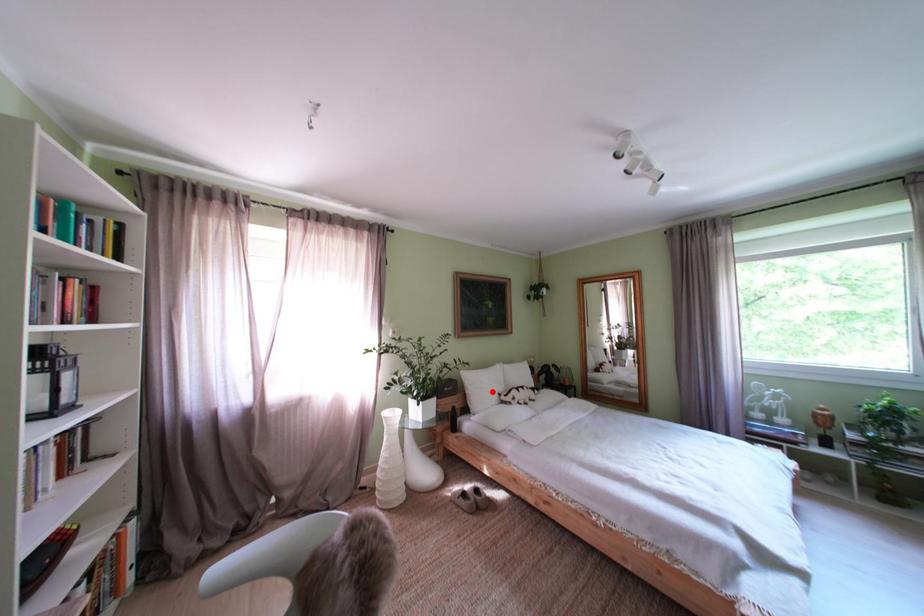
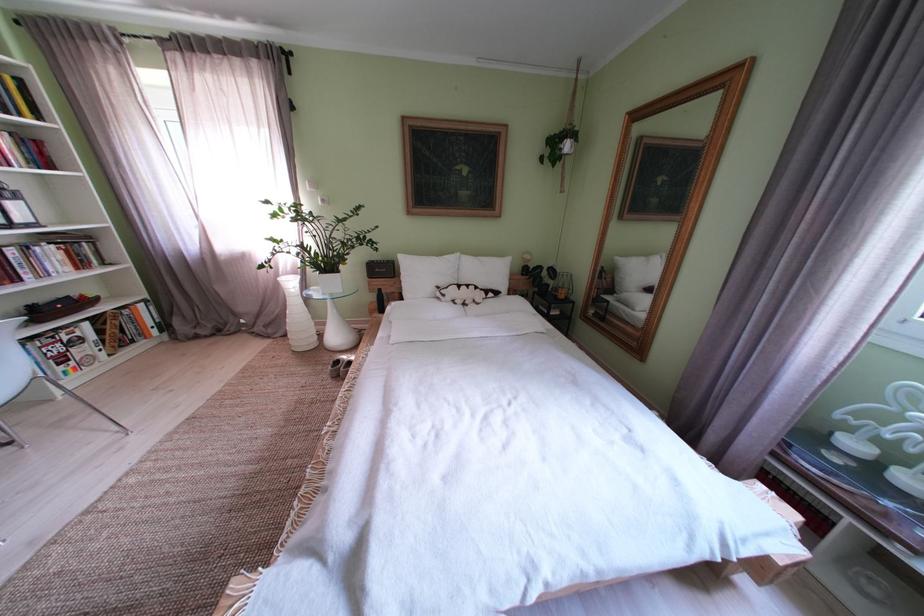
Where in the second image is the point corresponding to the highlighted location from the first image?

(429, 280)